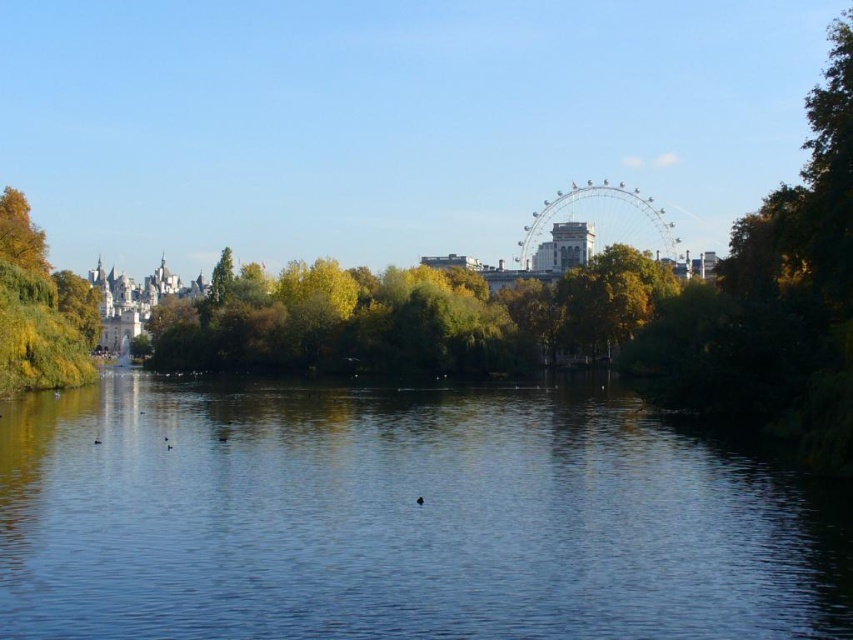
Question: Which of the following is the closest to the observer?

Choices:
 (A) (48, 445)
 (B) (421, 502)

Answer: (B)

Question: Where is transparent water at center located in relation to green leafy tree at left in the image?

Choices:
 (A) below
 (B) above

Answer: (A)

Question: Which of these objects is positioned farthest from the brown fuzzy duck at center?

Choices:
 (A) transparent water at center
 (B) green leafy tree at left

Answer: (B)

Question: Which object is the closest to the green leafy tree at left?

Choices:
 (A) brown fuzzy duck at center
 (B) transparent water at center

Answer: (B)

Question: Is transparent water at center positioned behind brown fuzzy duck at center?

Choices:
 (A) no
 (B) yes

Answer: (A)

Question: Can you confirm if green leafy tree at left is positioned to the right of brown fuzzy duck at center?

Choices:
 (A) yes
 (B) no

Answer: (B)